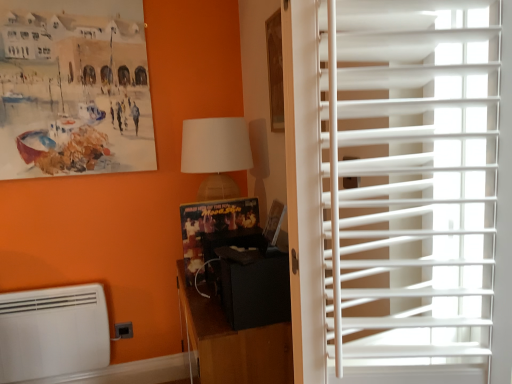
Question: Is black matte cabinet at center closer to camera compared to white matte air conditioning at lower left?

Choices:
 (A) no
 (B) yes

Answer: (B)

Question: Does black matte cabinet at center turn towards white matte air conditioning at lower left?

Choices:
 (A) yes
 (B) no

Answer: (A)

Question: Is black matte cabinet at center positioned behind white matte air conditioning at lower left?

Choices:
 (A) no
 (B) yes

Answer: (A)

Question: Does black matte cabinet at center have a lesser height compared to white matte air conditioning at lower left?

Choices:
 (A) no
 (B) yes

Answer: (A)

Question: Is black matte cabinet at center positioned beyond the bounds of white matte air conditioning at lower left?

Choices:
 (A) no
 (B) yes

Answer: (B)

Question: Does black matte cabinet at center have a larger size compared to white matte air conditioning at lower left?

Choices:
 (A) yes
 (B) no

Answer: (A)

Question: Is black matte cabinet at center thinner than matte white lampshade at upper center?

Choices:
 (A) yes
 (B) no

Answer: (B)

Question: Would you say black matte cabinet at center is a long distance from matte white lampshade at upper center?

Choices:
 (A) yes
 (B) no

Answer: (B)

Question: Is black matte cabinet at center facing towards matte white lampshade at upper center?

Choices:
 (A) no
 (B) yes

Answer: (A)

Question: Considering the relative sizes of black matte cabinet at center and matte white lampshade at upper center in the image provided, is black matte cabinet at center shorter than matte white lampshade at upper center?

Choices:
 (A) yes
 (B) no

Answer: (B)

Question: Can you confirm if black matte cabinet at center is positioned to the left of matte white lampshade at upper center?

Choices:
 (A) yes
 (B) no

Answer: (B)

Question: Is black matte cabinet at center with matte white lampshade at upper center?

Choices:
 (A) yes
 (B) no

Answer: (B)

Question: Is matte white lampshade at upper center taller than white plastic blinds at right?

Choices:
 (A) no
 (B) yes

Answer: (A)